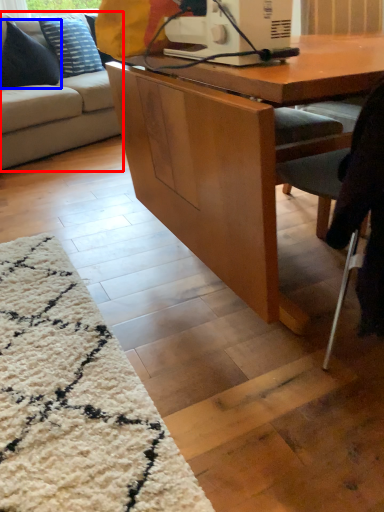
Question: Among these objects, which one is farthest to the camera, studio couch (highlighted by a red box) or pillow (highlighted by a blue box)?

Choices:
 (A) studio couch
 (B) pillow

Answer: (B)